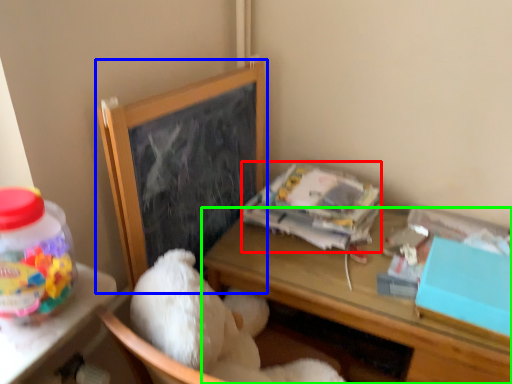
Question: Which object is the farthest from paperback book (highlighted by a red box)? Choose among these: bulletin board (highlighted by a blue box) or desk (highlighted by a green box).

Choices:
 (A) bulletin board
 (B) desk

Answer: (A)